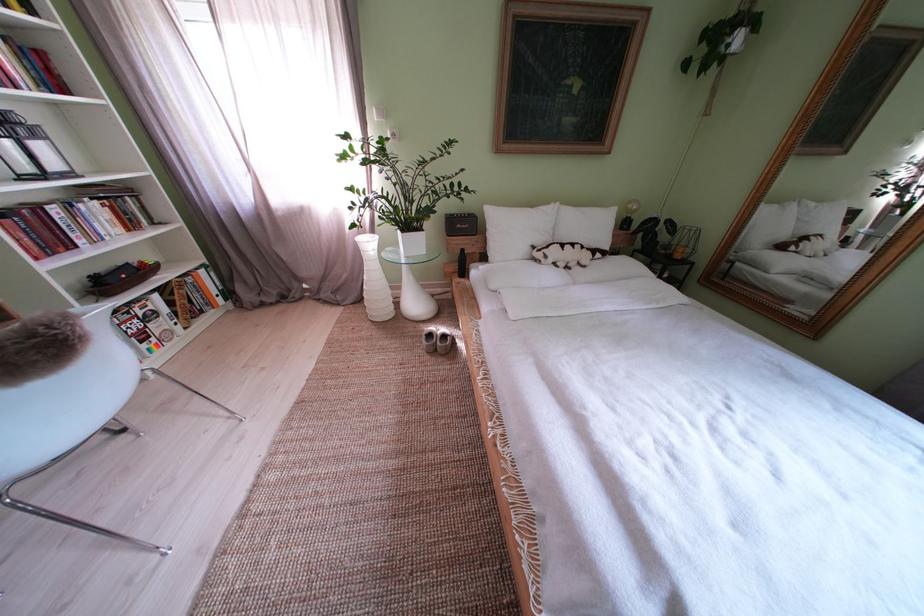
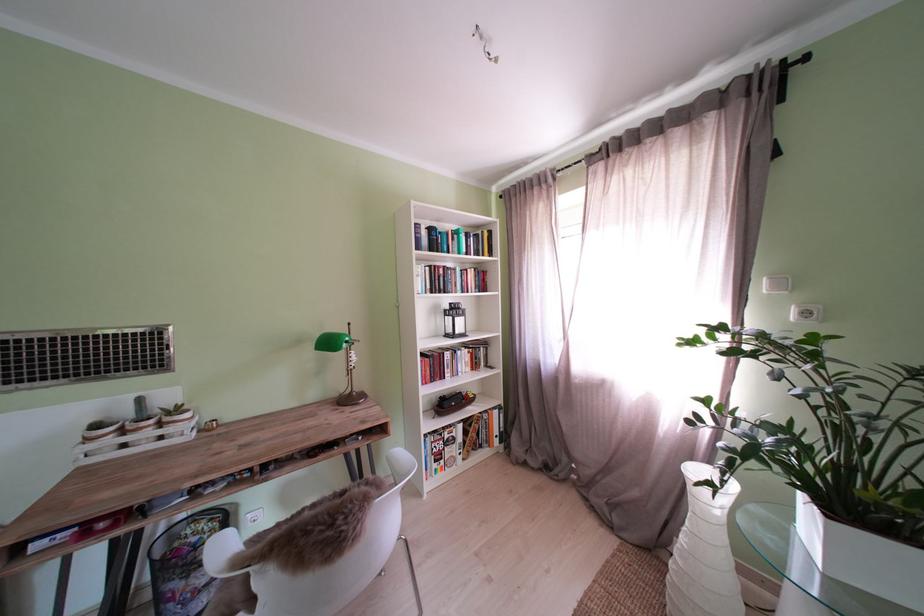
Find the pixel in the second image that matches the point at 176,315 in the first image.

(470, 444)